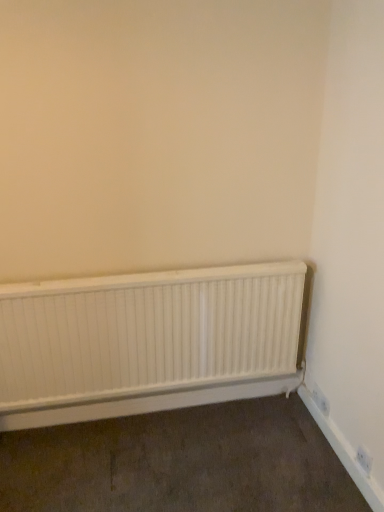
Measure the distance between point (146,282) and camera.

Point (146,282) and camera are 5.84 feet apart.

What is the approximate height of white matte radiator at lower center?

white matte radiator at lower center is 23.27 inches in height.

What do you see at coordinates (149, 341) in the screenshot? I see `white matte radiator at lower center` at bounding box center [149, 341].

The image size is (384, 512). In order to click on white matte radiator at lower center in this screenshot , I will do `click(149, 341)`.

The width and height of the screenshot is (384, 512). What do you see at coordinates (320, 400) in the screenshot?
I see `white plastic electric outlet at lower right` at bounding box center [320, 400].

Measure the distance between point (322, 398) and camera.

The distance of point (322, 398) from camera is 6.43 feet.

This screenshot has height=512, width=384. I want to click on white plastic electric outlet at lower right, so click(x=320, y=400).

Identify the location of white matte radiator at lower center. (149, 341).

Which object is positioned more to the right, white plastic electric outlet at lower right or white matte radiator at lower center?

white plastic electric outlet at lower right is more to the right.

Is white plastic electric outlet at lower right in front of white matte radiator at lower center?

No, white plastic electric outlet at lower right is behind white matte radiator at lower center.

Which point is more distant from viewer, (x=318, y=397) or (x=62, y=353)?

The point (x=318, y=397) is farther.

From the image's perspective, is white plastic electric outlet at lower right below white matte radiator at lower center?

Correct, white plastic electric outlet at lower right appears lower than white matte radiator at lower center in the image.

From a real-world perspective, is white plastic electric outlet at lower right on top of white matte radiator at lower center?

No, from a real-world perspective, white plastic electric outlet at lower right is not on top of white matte radiator at lower center.

Is white plastic electric outlet at lower right thinner than white matte radiator at lower center?

Correct, the width of white plastic electric outlet at lower right is less than that of white matte radiator at lower center.

Who is taller, white plastic electric outlet at lower right or white matte radiator at lower center?

Standing taller between the two is white matte radiator at lower center.

Considering the sizes of objects white plastic electric outlet at lower right and white matte radiator at lower center in the image provided, who is smaller, white plastic electric outlet at lower right or white matte radiator at lower center?

With smaller size is white plastic electric outlet at lower right.

Is white plastic electric outlet at lower right spatially inside white matte radiator at lower center, or outside of it?

white plastic electric outlet at lower right is spatially situated outside white matte radiator at lower center.

Is there a large distance between white plastic electric outlet at lower right and white matte radiator at lower center?

That's not correct — white plastic electric outlet at lower right is a little close to white matte radiator at lower center.

Could you tell me if white plastic electric outlet at lower right is facing white matte radiator at lower center?

No, white plastic electric outlet at lower right is not turned towards white matte radiator at lower center.

Can you tell me how much white plastic electric outlet at lower right and white matte radiator at lower center differ in facing direction?

They differ by 89.8 degrees in their facing directions.

How far apart are white plastic electric outlet at lower right and white matte radiator at lower center?

The distance of white plastic electric outlet at lower right from white matte radiator at lower center is 80.47 centimeters.

The width and height of the screenshot is (384, 512). Find the location of `electric outlet on the right of the white matte radiator at lower center`. electric outlet on the right of the white matte radiator at lower center is located at coordinates (320, 400).

Visually, is white matte radiator at lower center positioned to the left or to the right of white plastic electric outlet at lower right?

white matte radiator at lower center is to the left of white plastic electric outlet at lower right.

Looking at this image, who is more distant, white matte radiator at lower center or white plastic electric outlet at lower right?

white plastic electric outlet at lower right is behind.

Considering the positions of point (257, 375) and point (324, 407), is point (257, 375) closer or farther from the camera than point (324, 407)?

Point (257, 375).

From the image's perspective, is white matte radiator at lower center located above white plastic electric outlet at lower right?

Correct, white matte radiator at lower center appears higher than white plastic electric outlet at lower right in the image.

From a real-world perspective, is white matte radiator at lower center physically located above or below white plastic electric outlet at lower right?

In terms of real-world spatial position, white matte radiator at lower center is above white plastic electric outlet at lower right.

Considering the relative sizes of white matte radiator at lower center and white plastic electric outlet at lower right in the image provided, is white matte radiator at lower center wider than white plastic electric outlet at lower right?

Yes, white matte radiator at lower center is wider than white plastic electric outlet at lower right.

Does white matte radiator at lower center have a greater height compared to white plastic electric outlet at lower right?

Indeed, white matte radiator at lower center has a greater height compared to white plastic electric outlet at lower right.

Considering the sizes of objects white matte radiator at lower center and white plastic electric outlet at lower right in the image provided, who is bigger, white matte radiator at lower center or white plastic electric outlet at lower right?

With larger size is white matte radiator at lower center.

Would you say white plastic electric outlet at lower right is part of white matte radiator at lower center's contents?

Actually, white plastic electric outlet at lower right is outside white matte radiator at lower center.

Is white matte radiator at lower center positioned far away from white plastic electric outlet at lower right?

Actually, white matte radiator at lower center and white plastic electric outlet at lower right are a little close together.

Is white matte radiator at lower center oriented away from white plastic electric outlet at lower right?

No.

In the scene shown: How different are the orientations of white matte radiator at lower center and white plastic electric outlet at lower right in degrees?

There is a 89.8-degree angle between the facing directions of white matte radiator at lower center and white plastic electric outlet at lower right.

Where is `electric outlet below the white matte radiator at lower center (from a real-world perspective)`? This screenshot has height=512, width=384. electric outlet below the white matte radiator at lower center (from a real-world perspective) is located at coordinates (320, 400).

Identify the location of radiator above the white plastic electric outlet at lower right (from a real-world perspective). This screenshot has height=512, width=384. (149, 341).

Where is `electric outlet below the white matte radiator at lower center (from a real-world perspective)`? The image size is (384, 512). electric outlet below the white matte radiator at lower center (from a real-world perspective) is located at coordinates (320, 400).